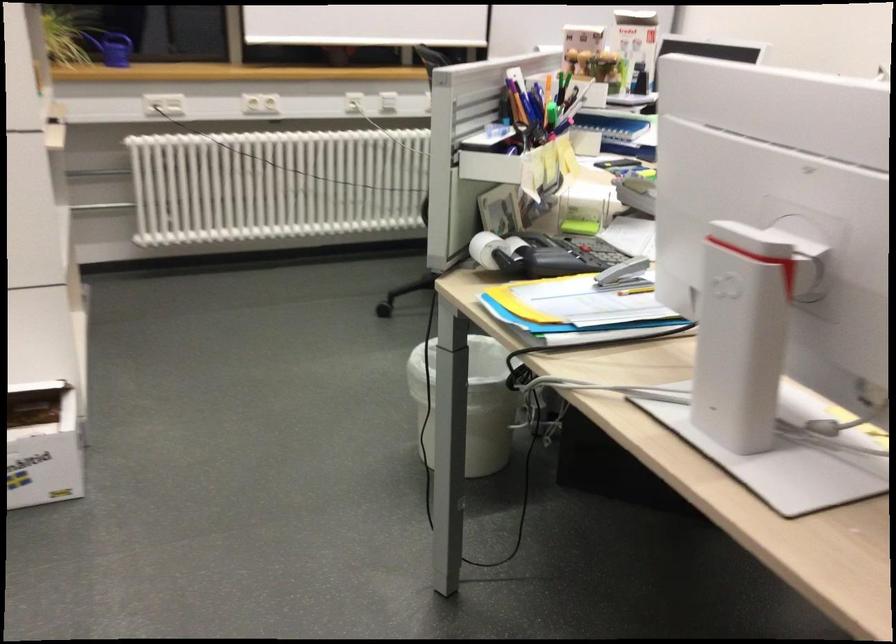
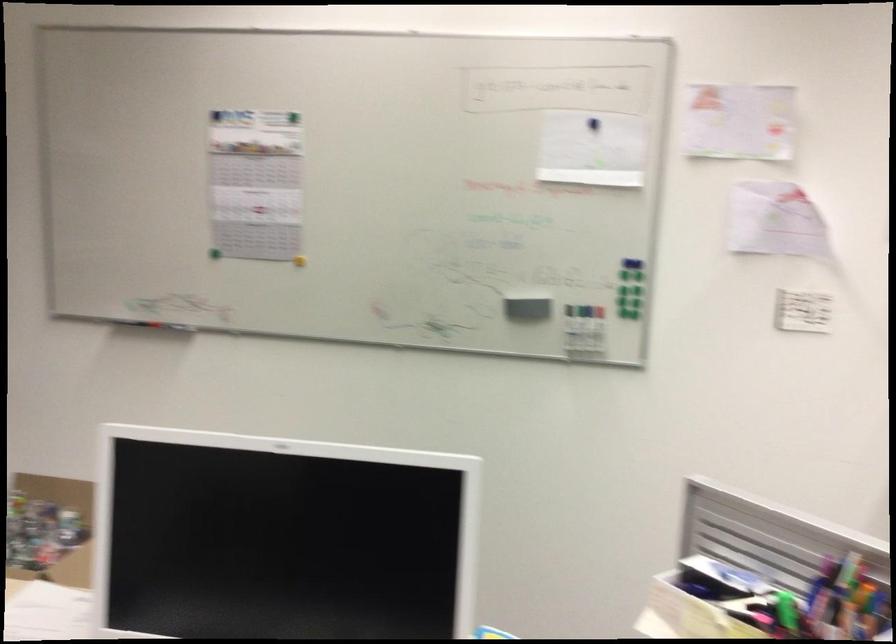
Where in the second image is the point corresponding to pixel 524 106 from the first image?

(787, 610)